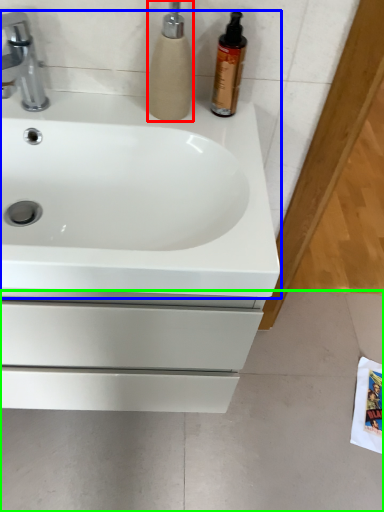
Question: Which object is the closest to the soap dispenser (highlighted by a red box)? Choose among these: sink (highlighted by a blue box) or concrete (highlighted by a green box).

Choices:
 (A) sink
 (B) concrete

Answer: (A)